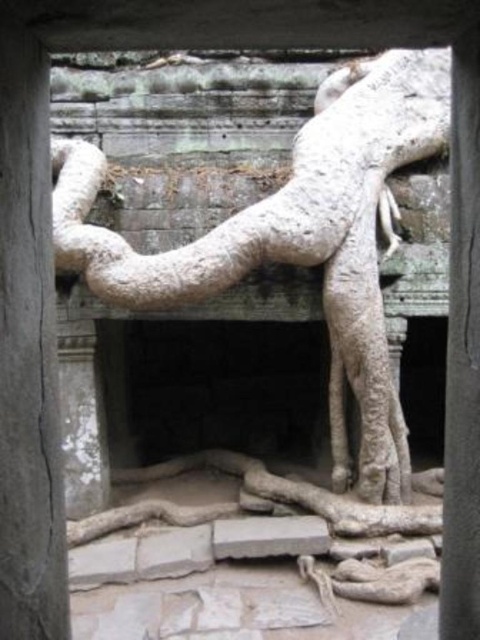
Is point (407, 104) positioned before point (472, 508)?

No.

Between white rough stone roots at upper center and smooth stone pillar at center, which one is positioned higher?

white rough stone roots at upper center

Locate an element on the screen. white rough stone roots at upper center is located at coordinates (298, 237).

Does white rough stone roots at upper center appear over gray stone pillar at center?

Correct, white rough stone roots at upper center is located above gray stone pillar at center.

Does white rough stone roots at upper center have a greater height compared to gray stone pillar at center?

Indeed, white rough stone roots at upper center has a greater height compared to gray stone pillar at center.

Who is more distant from viewer, (415, 115) or (4, 461)?

The point (415, 115) is more distant.

Locate an element on the screen. white rough stone roots at upper center is located at coordinates (298, 237).

Who is more forward, (46, 128) or (460, 45)?

Positioned in front is point (460, 45).

Can you confirm if gray stone pillar at center is smaller than smooth stone pillar at center?

Yes.

Between point (7, 412) and point (443, 577), which one is positioned in front?

Point (7, 412) is in front.

Where is `gray stone pillar at center`? Image resolution: width=480 pixels, height=640 pixels. gray stone pillar at center is located at coordinates pyautogui.click(x=27, y=348).